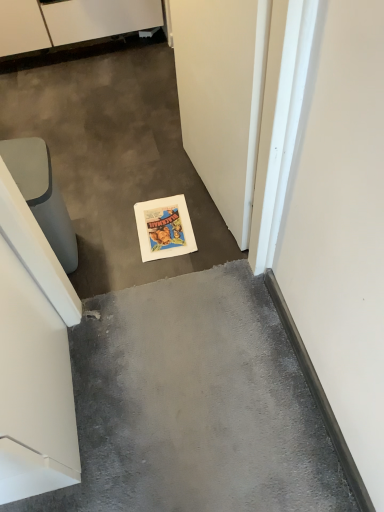
Question: Would you say matte gray trash can at left is to the left or to the right of white matte door at lower center in the picture?

Choices:
 (A) left
 (B) right

Answer: (A)

Question: Relative to white matte door at lower center, is matte gray trash can at left in front or behind?

Choices:
 (A) front
 (B) behind

Answer: (B)

Question: Based on their relative distances, which object is farther from the white matte door at lower center?

Choices:
 (A) white glossy cabinet at upper left
 (B) matte gray trash can at left

Answer: (A)

Question: Estimate the real-world distances between objects in this image. Which object is farther from the matte gray trash can at left?

Choices:
 (A) white glossy cabinet at upper left
 (B) white matte door at lower center

Answer: (A)